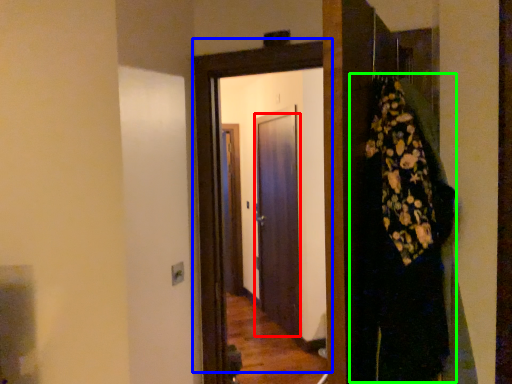
Question: Based on their relative distances, which object is nearer to door (highlighted by a red box)? Choose from door (highlighted by a blue box) and dress (highlighted by a green box).

Choices:
 (A) door
 (B) dress

Answer: (A)